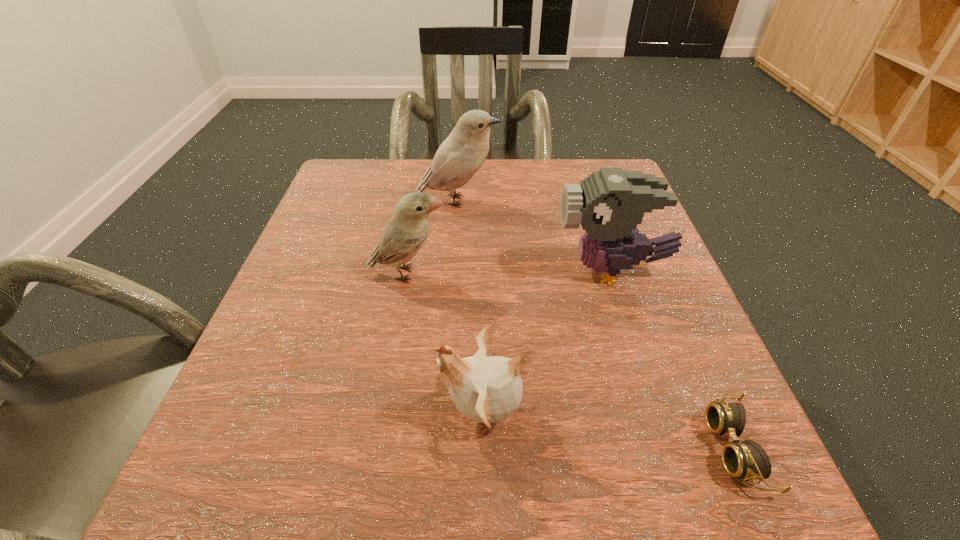
Where is `vacant area located at the beak of the nearest bird`? The height and width of the screenshot is (540, 960). vacant area located at the beak of the nearest bird is located at coordinates (359, 411).

Find the location of a particular element. The height and width of the screenshot is (540, 960). free region located 0.250m at the beak of the nearest bird is located at coordinates (258, 411).

I want to click on vacant space located 0.090m through the lenses of the goggles, so click(643, 448).

Locate an element on the screen. This screenshot has height=540, width=960. free location located 0.150m through the lenses of the goggles is located at coordinates (597, 448).

What are the coordinates of `free point located 0.110m through the lenses of the goggles` in the screenshot? It's located at point(628,448).

At what (x,y) coordinates should I click in order to perform the action: click on object at the far edge. Please return your answer as a coordinate pair (x, y). This screenshot has height=540, width=960. Looking at the image, I should click on [459, 157].

This screenshot has height=540, width=960. I want to click on bird that is at the near edge, so click(487, 389).

Find the location of a particular element. goggles at the near edge is located at coordinates (747, 460).

The height and width of the screenshot is (540, 960). In order to click on object that is at the left edge in this screenshot , I will do `click(406, 231)`.

Locate an element on the screen. The width and height of the screenshot is (960, 540). bird positioned at the right edge is located at coordinates (609, 203).